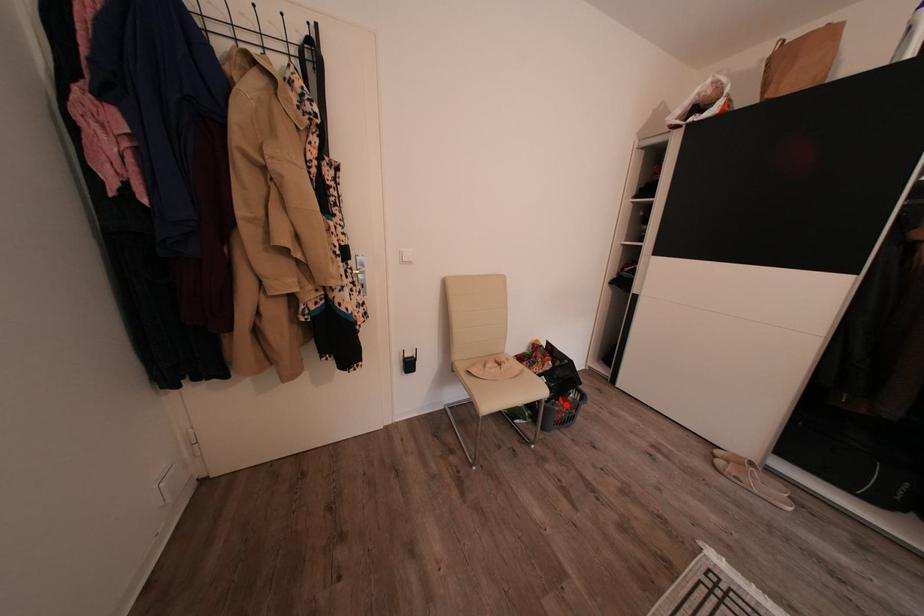
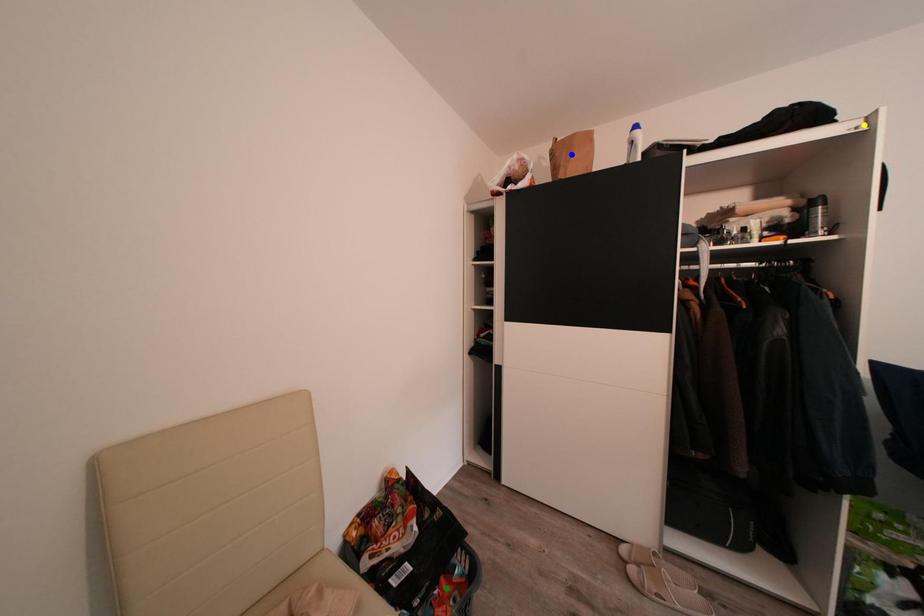
Question: I am providing you with two images of the same scene from different viewpoints. A red point is marked on the first image. You are given multiple points on the second image. Can you choose the point in image 2 that corresponds to the point in image 1?

Choices:
 (A) green point
 (B) blue point
 (C) yellow point

Answer: (A)